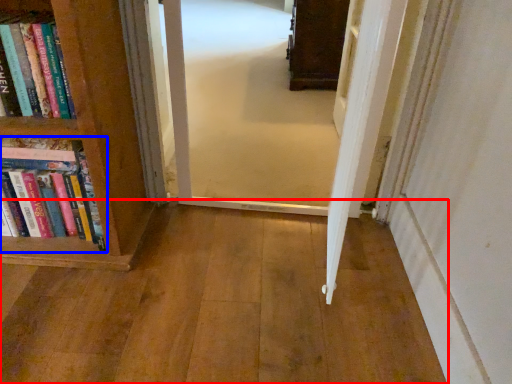
Question: Which object is closer to the camera taking this photo, corridor (highlighted by a red box) or book (highlighted by a blue box)?

Choices:
 (A) corridor
 (B) book

Answer: (A)